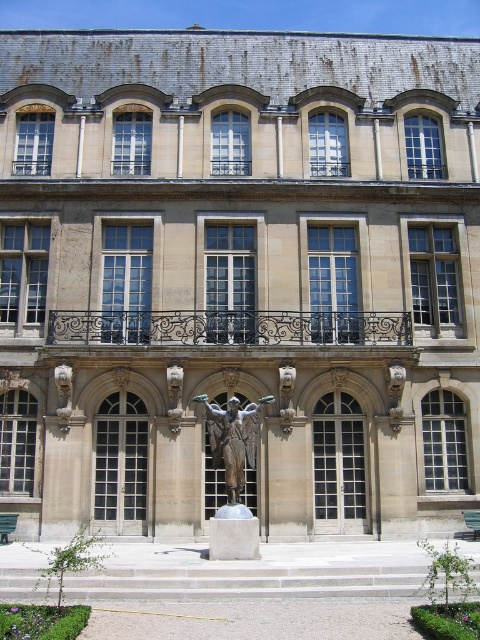
You are a maintenance worker needing to inspect the black wrought iron balcony at center and the bronze statue at center. You have a ladder that is 6 meters long. Can you reach both objects with your ladder if you place it at the base of the building?

The distance between the black wrought iron balcony at center and the bronze statue at center is 7.20 meters. Since your ladder is only 6 meters long, it is not long enough to span the distance between them. You would need a longer ladder or another method to access both objects.

You are standing in front of the classical building and notice a point marked at coordinates (229, 326). Based on the building description, can you identify which architectural feature this point is located on?

The point at (229, 326) is on the black wrought iron balcony at center.